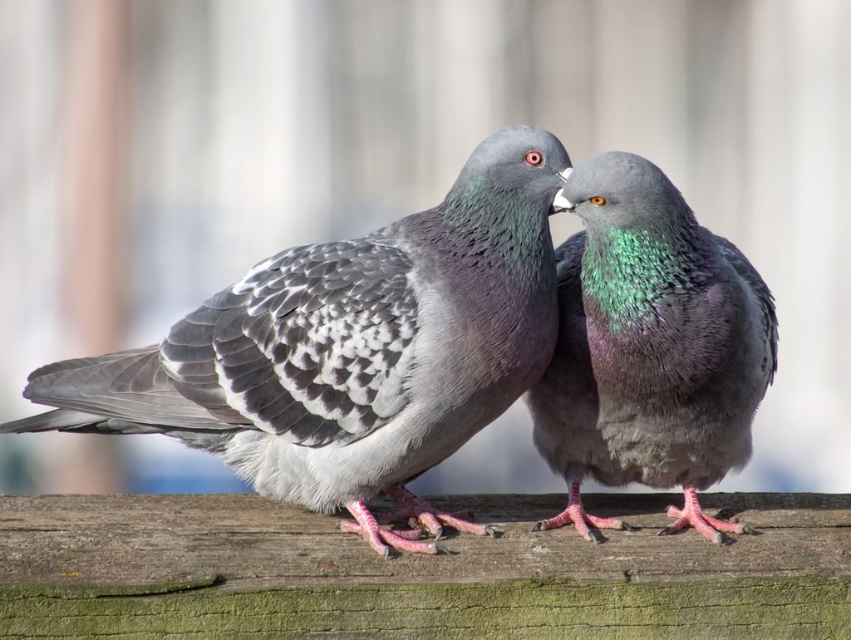
You are a photographer aiming to capture the pigeons on the wooden surface. You notice a point at coordinates point (351, 349). What is located at this point?

The point (351, 349) is on gray speckled feathers at center.

You are a bird enthusiast observing the two pigeons in the image. You notice both gray speckled feathers at center and shiny green feathers at center. Which of these two feathers is located to the left of the other?

The gray speckled feathers at center is positioned on the left side of shiny green feathers at center.

You are a bird enthusiast observing two pigeons on a wooden surface. You notice the gray speckled feathers at center and the shiny green feathers at center. How far apart are these two sets of feathers?

The gray speckled feathers at center and shiny green feathers at center are 13.41 inches apart.